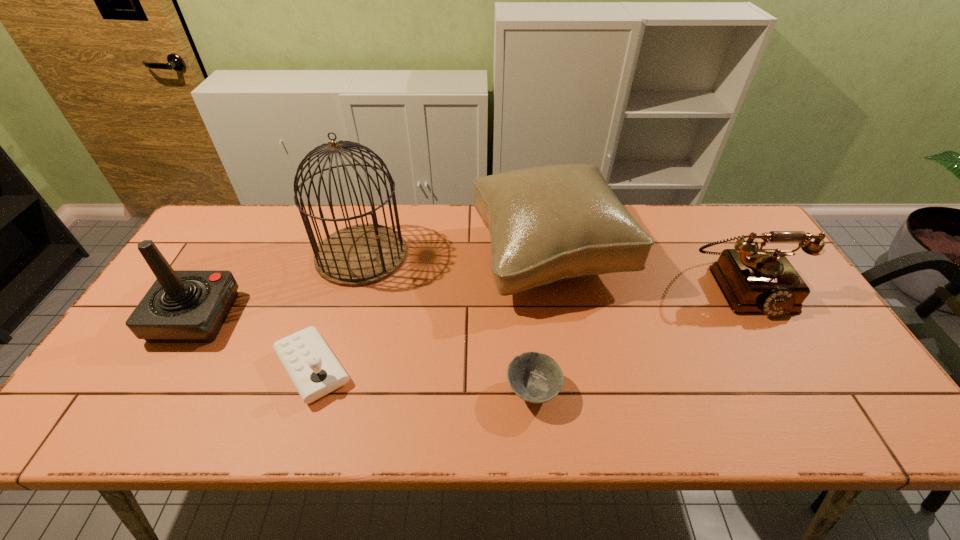
You are a GUI agent. You are given a task and a screenshot of the screen. Output one action in this format:
    pyautogui.click(x=<x>, y=<y>)
    Task: Click on the vacant point located on the front of the cushion
    The height and width of the screenshot is (540, 960).
    Given the screenshot: What is the action you would take?
    (x=579, y=431)

Locate an element on the screen. This screenshot has height=540, width=960. vacant space located on the front-facing side of the taller joystick is located at coordinates (322, 318).

Identify the location of vacant region located on the dial of the telephone. The image size is (960, 540). (829, 433).

Identify the location of blank space located on the left of the right joystick. (172, 368).

I want to click on vacant area situated on the right of the bowl, so click(x=686, y=391).

Image resolution: width=960 pixels, height=540 pixels. In order to click on birdcage that is positioned at the far edge in this screenshot , I will do `click(363, 254)`.

The height and width of the screenshot is (540, 960). What are the coordinates of `cushion situated at the far edge` in the screenshot? It's located at (547, 223).

Find the location of a particular element. joystick situated at the near edge is located at coordinates (314, 370).

Locate an element on the screen. This screenshot has width=960, height=540. bowl that is at the near edge is located at coordinates (536, 378).

At what (x,y) coordinates should I click in order to perform the action: click on object situated at the left edge. Please return your answer as a coordinate pair (x, y). Looking at the image, I should click on (182, 306).